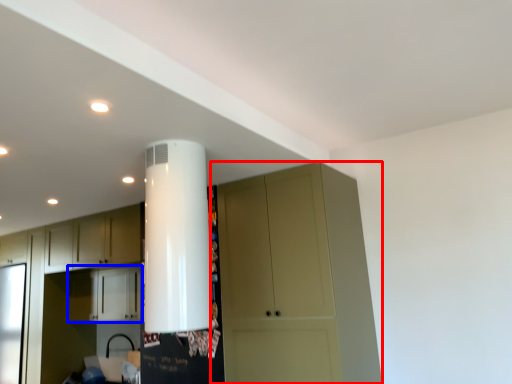
Question: Which object appears farthest to the camera in this image, cupboard (highlighted by a red box) or cabinetry (highlighted by a blue box)?

Choices:
 (A) cupboard
 (B) cabinetry

Answer: (B)